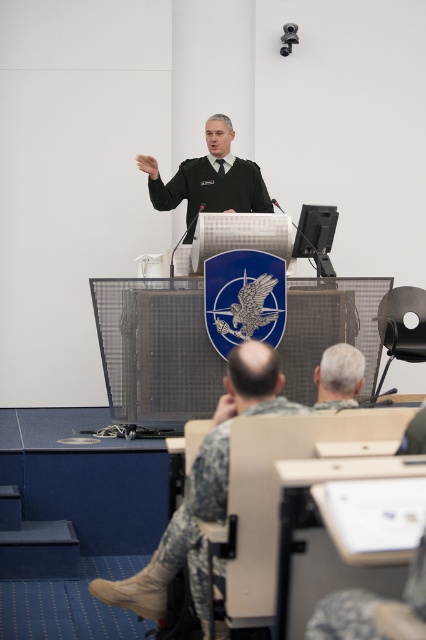
Question: Among these objects, which one is nearest to the camera?

Choices:
 (A) camouflage fabric uniform at lower center
 (B) gray matte hair at center
 (C) green uniform at center

Answer: (A)

Question: Which point is farther to the camera?

Choices:
 (A) (193, 541)
 (B) (345, 380)
 (C) (252, 193)

Answer: (C)

Question: Is camouflage fabric uniform at lower center further to the viewer compared to green uniform at center?

Choices:
 (A) yes
 (B) no

Answer: (B)

Question: Which of the following is the farthest from the observer?

Choices:
 (A) camouflage fabric uniform at lower center
 (B) green uniform at center

Answer: (B)

Question: Is camouflage fabric uniform at lower center further to the viewer compared to green uniform at center?

Choices:
 (A) yes
 (B) no

Answer: (B)

Question: Can you confirm if green uniform at center is bigger than gray matte hair at center?

Choices:
 (A) yes
 (B) no

Answer: (A)